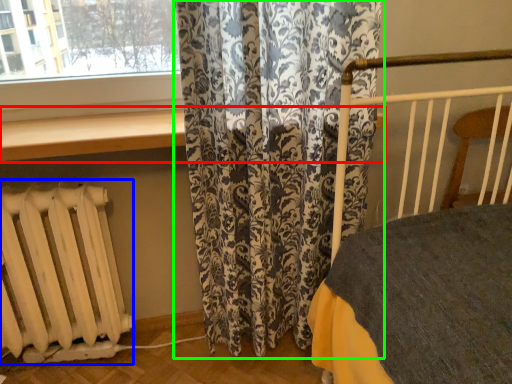
Question: Which is nearer to the window sill (highlighted by a red box)? radiator (highlighted by a blue box) or curtain (highlighted by a green box).

Choices:
 (A) radiator
 (B) curtain

Answer: (B)